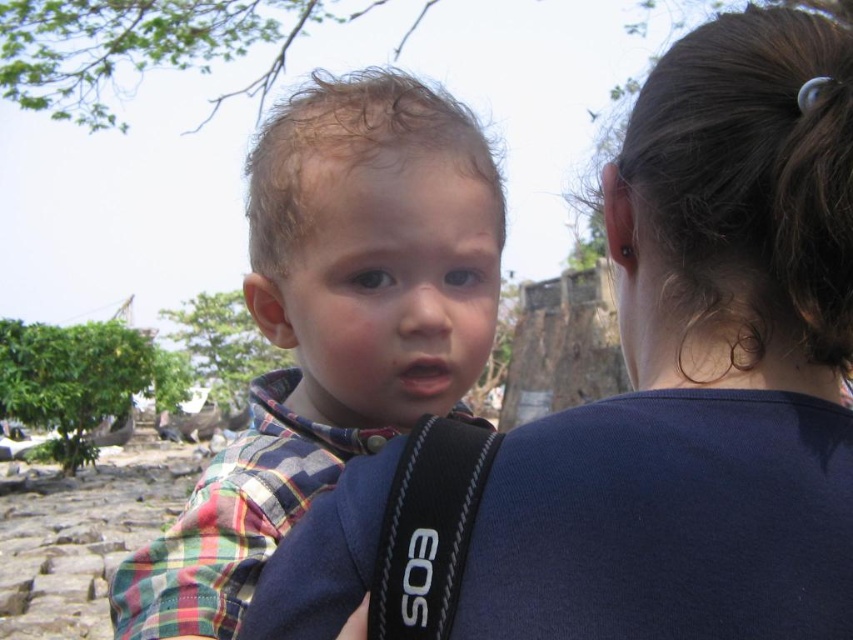
You are standing in a park and see the blue fabric shirt at upper center. If you want to take a photo of it with your phone, will you need to zoom in or out to frame it properly?

The blue fabric shirt at upper center is 27.08 meters away from the viewer, so you will need to zoom in to frame it properly.

You are standing at the origin of the coordinate system in the image. There are two points marked in the scene. The first point is at coordinates point (635,275) and the second point is at point (299,124). Which point is closer to you?

Point (299,124) is closer to you because it is in front of point (635,275).

You are trying to decide whether to hang a decorative hook on the wall between the blue fabric shirt at upper center and the black fabric strap at center. Based on their widths, can you determine if the hook will fit between them without overlapping?

The blue fabric shirt at upper center might be wider than black fabric strap at center, so the hook may not fit between them without overlapping if the total width of both objects exceeds the available space.